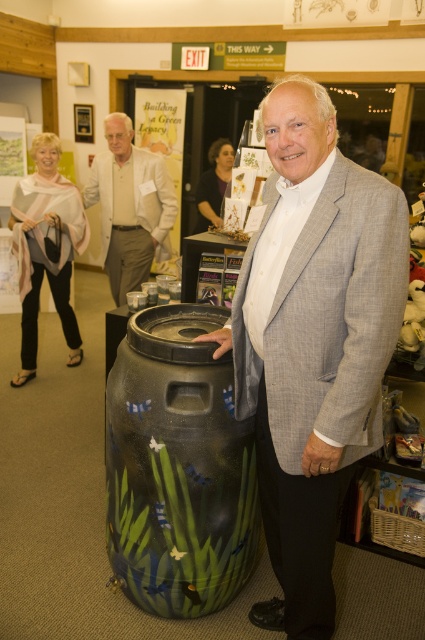
At what (x,y) coordinates should I click in order to perform the action: click on painted ceramic barrel at center. Please return your answer as a coordinate pair (x, y). Looking at the image, I should click on (178, 467).

Which is in front, point (240, 564) or point (98, 182)?

Point (240, 564) is in front.

This screenshot has height=640, width=425. Find the location of `painted ceramic barrel at center`. painted ceramic barrel at center is located at coordinates (178, 467).

Can you confirm if gray wool suit at center is wider than light gray scarf at left?

Incorrect, gray wool suit at center's width does not surpass light gray scarf at left's.

Is gray wool suit at center smaller than light gray scarf at left?

No.

Based on the photo, who is more forward, (272,227) or (36,356)?

Point (272,227) is in front.

Image resolution: width=425 pixels, height=640 pixels. Identify the location of gray wool suit at center. (312, 340).

Which is more to the right, gray wool suit at center or white textured suit at center?

gray wool suit at center

Which is behind, point (351, 182) or point (153, 179)?

Positioned behind is point (153, 179).

Locate an element on the screen. The width and height of the screenshot is (425, 640). gray wool suit at center is located at coordinates (312, 340).